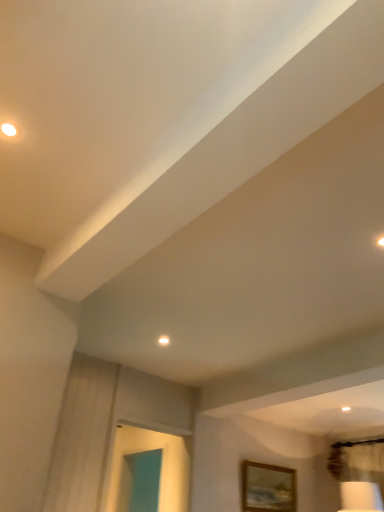
Question: Looking at their shapes, would you say wooden picture frame at lower right is wider or thinner than white glossy droplight at upper center?

Choices:
 (A) thin
 (B) wide

Answer: (B)

Question: From their relative heights in the image, would you say wooden picture frame at lower right is taller or shorter than white glossy droplight at upper center?

Choices:
 (A) tall
 (B) short

Answer: (A)

Question: From a real-world perspective, is wooden picture frame at lower right above or below white glossy droplight at upper center?

Choices:
 (A) above
 (B) below

Answer: (B)

Question: Would you say white glossy droplight at upper center is to the left or to the right of wooden picture frame at lower right in the picture?

Choices:
 (A) right
 (B) left

Answer: (B)

Question: Based on their sizes in the image, would you say white glossy droplight at upper center is bigger or smaller than wooden picture frame at lower right?

Choices:
 (A) small
 (B) big

Answer: (A)

Question: Is white glossy droplight at upper center in front of or behind wooden picture frame at lower right in the image?

Choices:
 (A) behind
 (B) front

Answer: (B)

Question: Would you say white glossy droplight at upper center is inside or outside wooden picture frame at lower right?

Choices:
 (A) outside
 (B) inside

Answer: (A)